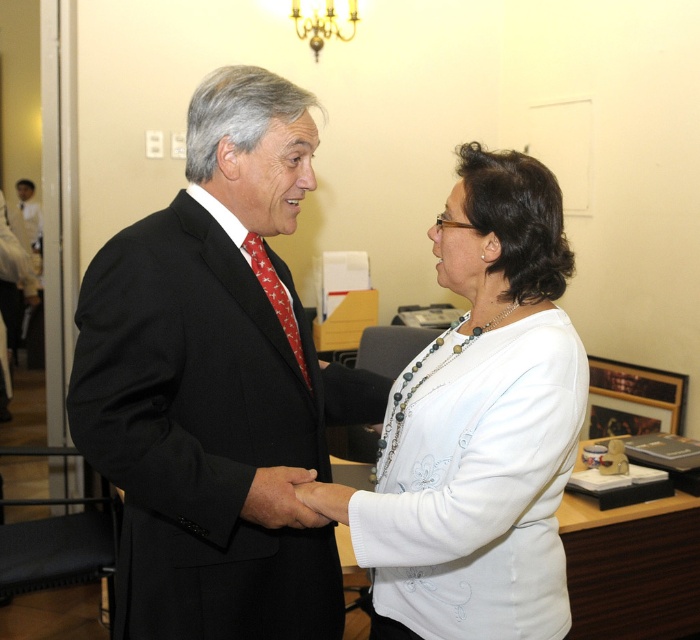
You are an artist trying to sketch the hands in the image. The smooth skin hand at center and the white matte hand at center are overlapping. Which hand should you draw first to properly layer them?

The smooth skin hand at center should be drawn first because it is taller than the white matte hand at center, indicating it is closer to the viewer and needs to be layered over the other hand.

You are a photographer at the event and need to ensure that both hands are visible in the photo. Given that the smooth skin hand at center and the white matte hand at center are overlapping, which hand should you adjust to make sure both are fully visible?

The smooth skin hand at center is bigger than the white matte hand at center, so you should adjust the white matte hand at center to move it slightly to the side to ensure both hands are fully visible.